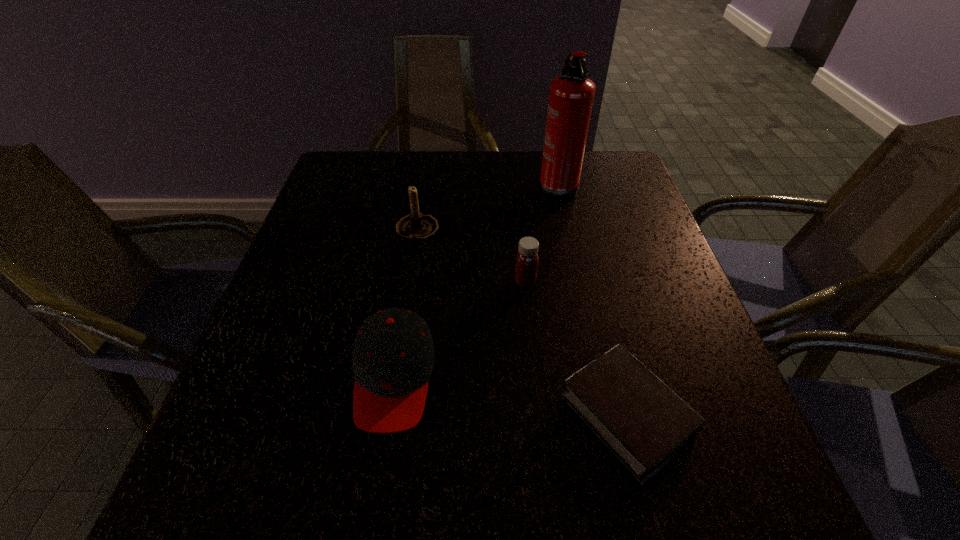
This screenshot has height=540, width=960. In order to click on object that is at the near right corner in this screenshot , I will do `click(644, 423)`.

Locate an element on the screen. free spot at the far edge of the desktop is located at coordinates (540, 165).

The height and width of the screenshot is (540, 960). I want to click on vacant region at the left edge of the desktop, so coord(235,429).

Where is `vacant space at the right edge`? This screenshot has height=540, width=960. vacant space at the right edge is located at coordinates 619,310.

In the image, there is a desktop. Find the location of `vacant space at the far left corner`. vacant space at the far left corner is located at coordinates (383, 159).

Locate an element on the screen. The image size is (960, 540). vacant area between the fire extinguisher and the second farthest object is located at coordinates [x=487, y=208].

Locate an element on the screen. This screenshot has height=540, width=960. vacant space that is in between the second tallest object and the fire extinguisher is located at coordinates (487, 208).

Image resolution: width=960 pixels, height=540 pixels. Identify the location of unoccupied position between the fire extinguisher and the cap. (475, 281).

Where is `free space between the second farthest object and the medicine`? The width and height of the screenshot is (960, 540). free space between the second farthest object and the medicine is located at coordinates (471, 256).

Identify the location of vacant region between the cap and the fourth shortest object. (405, 305).